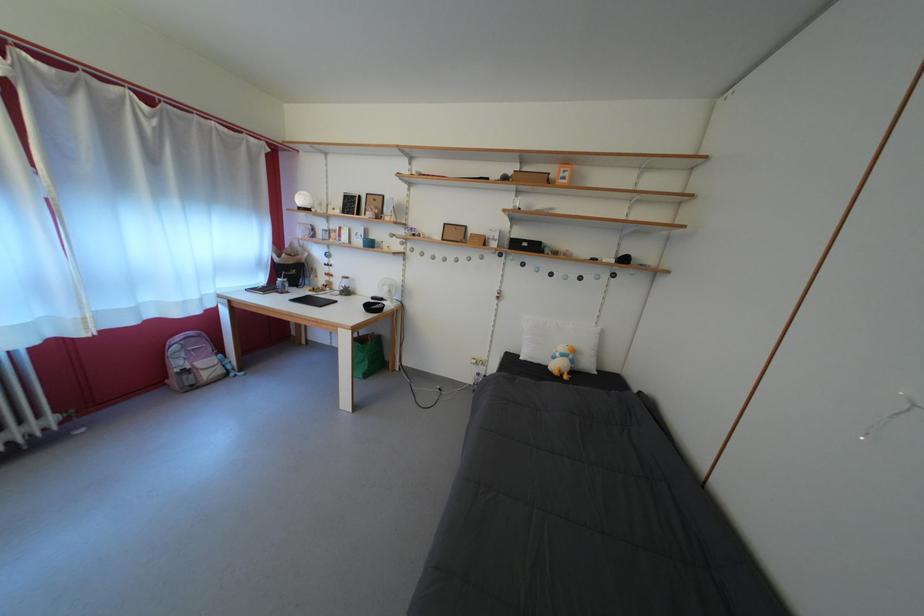
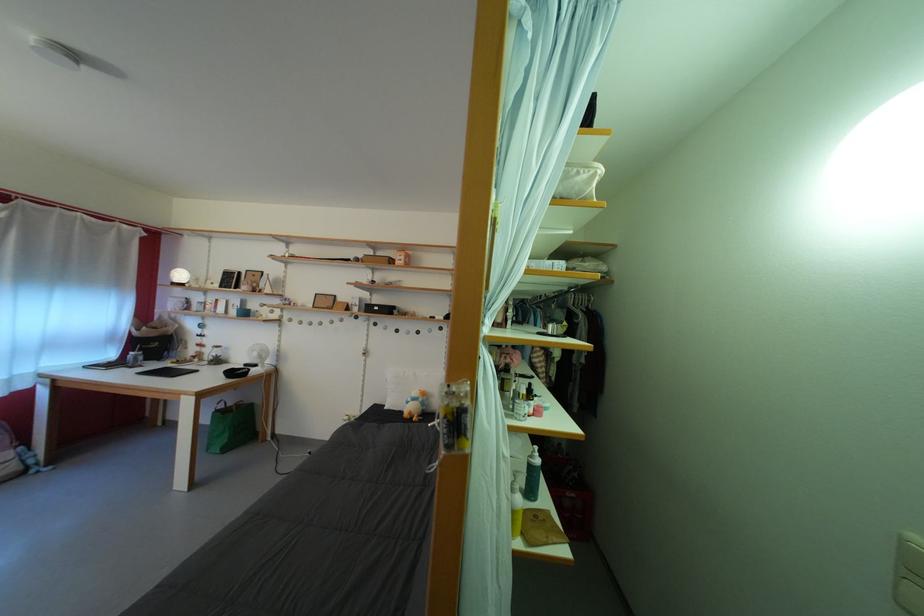
Find the pixel in the second image that matches point 565,361 in the first image.

(418, 405)